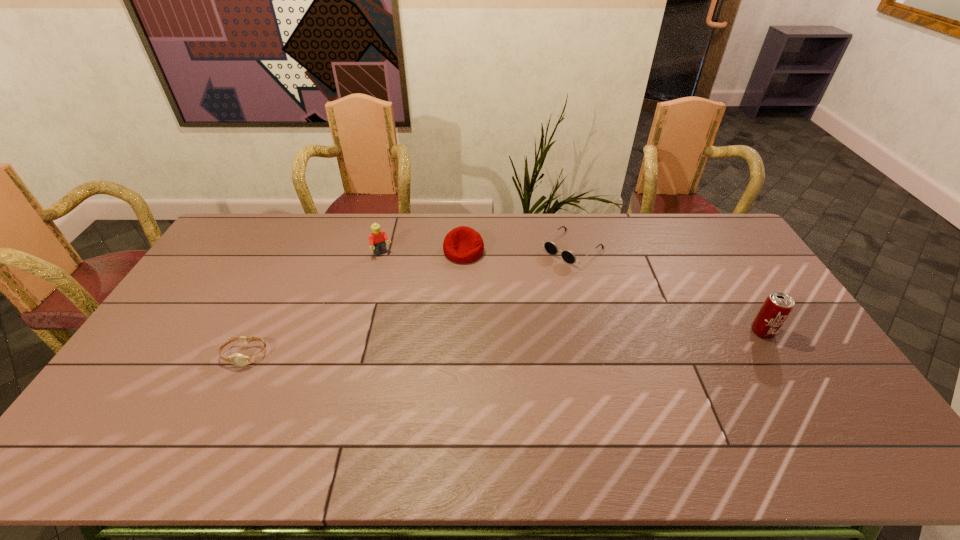
Locate an element on the screen. The height and width of the screenshot is (540, 960). free region located on the seat area of the third tallest object is located at coordinates (451, 353).

Identify the location of vacant space situated 0.390m on the seat area of the third tallest object. (451, 353).

Find the location of a particular element. free region located 0.080m on the seat area of the third tallest object is located at coordinates pos(460,280).

Find the location of a particular element. The height and width of the screenshot is (540, 960). vacant space situated on the front-facing side of the sunglasses is located at coordinates (499, 308).

Find the location of a particular element. vacant space located on the front-facing side of the sunglasses is located at coordinates (540, 275).

Identify the location of vacant area situated 0.290m on the front-facing side of the sunglasses. The height and width of the screenshot is (540, 960). (499, 308).

At what (x,y) coordinates should I click in order to perform the action: click on free space located on the face of the second object from left to right. Please return your answer as a coordinate pair (x, y). Looking at the image, I should click on (402, 280).

Where is `vacant point located on the face of the second object from left to right`? vacant point located on the face of the second object from left to right is located at coordinates coord(440,331).

This screenshot has width=960, height=540. In order to click on vacant space positioned on the face of the second object from left to right in this screenshot , I will do `click(395, 269)`.

Identify the location of beanbag located in the far edge section of the desktop. (463, 244).